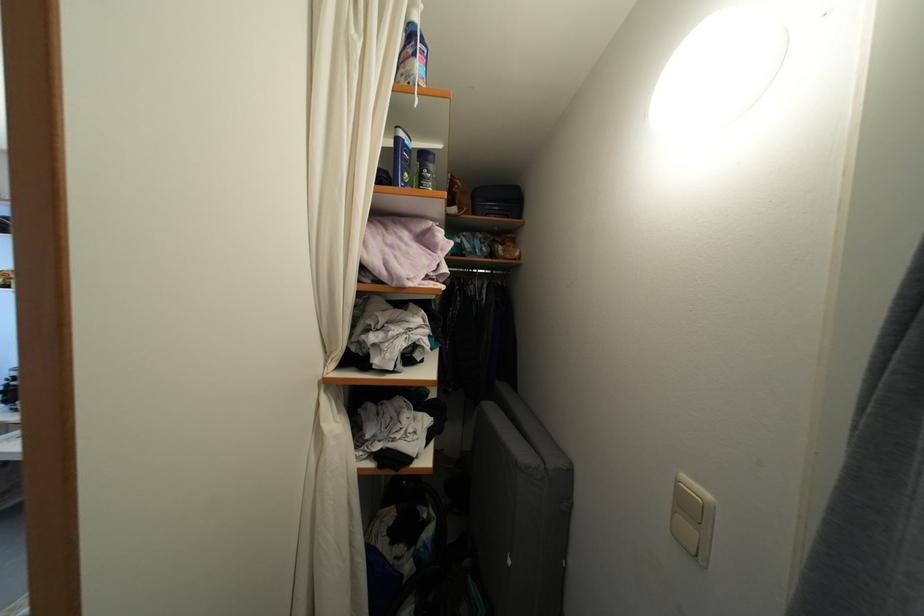
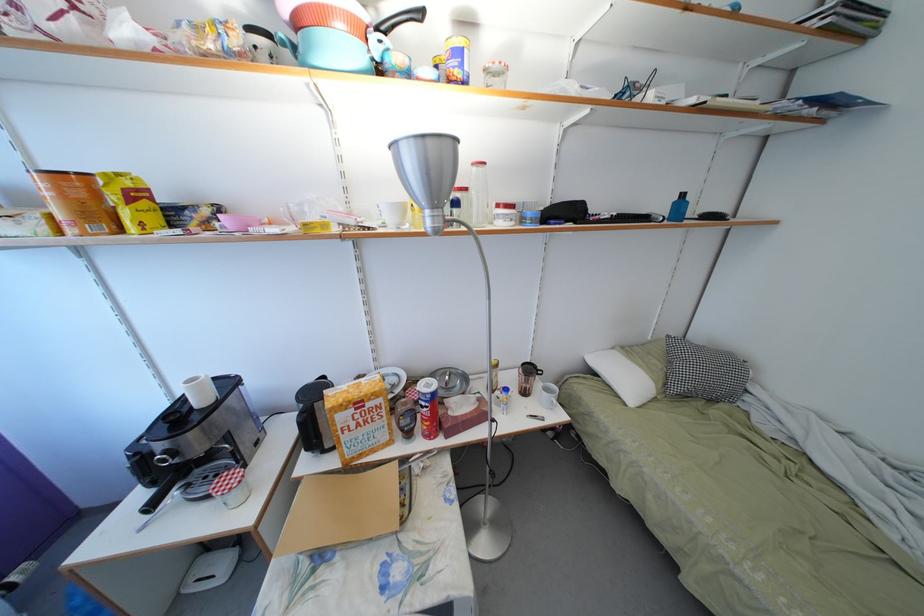
The images are taken continuously from a first-person perspective. In which direction are you moving?

The cameraman walked toward left, forward.